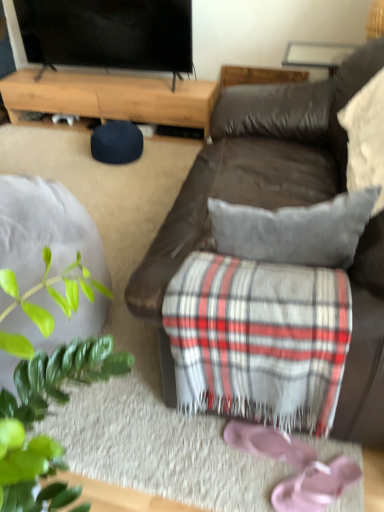
Question: Can you confirm if pink suede shoe at lower center is thinner than light brown wood at upper left?

Choices:
 (A) no
 (B) yes

Answer: (B)

Question: Is the position of pink suede shoe at lower center less distant than that of light brown wood at upper left?

Choices:
 (A) no
 (B) yes

Answer: (B)

Question: From the image's perspective, would you say pink suede shoe at lower center is positioned over light brown wood at upper left?

Choices:
 (A) no
 (B) yes

Answer: (A)

Question: Can you confirm if pink suede shoe at lower center is positioned to the left of light brown wood at upper left?

Choices:
 (A) no
 (B) yes

Answer: (A)

Question: Does pink suede shoe at lower center have a lesser height compared to light brown wood at upper left?

Choices:
 (A) yes
 (B) no

Answer: (A)

Question: Could you tell me if pink suede shoe at lower center is facing light brown wood at upper left?

Choices:
 (A) no
 (B) yes

Answer: (A)

Question: Considering the relative positions of light brown wood at upper left and pink fabric flip-flops at lower right in the image provided, is light brown wood at upper left behind pink fabric flip-flops at lower right?

Choices:
 (A) no
 (B) yes

Answer: (B)

Question: Can you confirm if light brown wood at upper left is smaller than pink fabric flip-flops at lower right?

Choices:
 (A) no
 (B) yes

Answer: (A)

Question: Does light brown wood at upper left appear on the left side of pink fabric flip-flops at lower right?

Choices:
 (A) yes
 (B) no

Answer: (A)

Question: From the image's perspective, would you say light brown wood at upper left is positioned over pink fabric flip-flops at lower right?

Choices:
 (A) yes
 (B) no

Answer: (A)

Question: From the image's perspective, is light brown wood at upper left under pink fabric flip-flops at lower right?

Choices:
 (A) yes
 (B) no

Answer: (B)

Question: From a real-world perspective, is light brown wood at upper left beneath pink fabric flip-flops at lower right?

Choices:
 (A) no
 (B) yes

Answer: (A)

Question: Considering the relative sizes of flat screen tv at upper left and white textured pillow at upper right in the image provided, is flat screen tv at upper left smaller than white textured pillow at upper right?

Choices:
 (A) no
 (B) yes

Answer: (A)